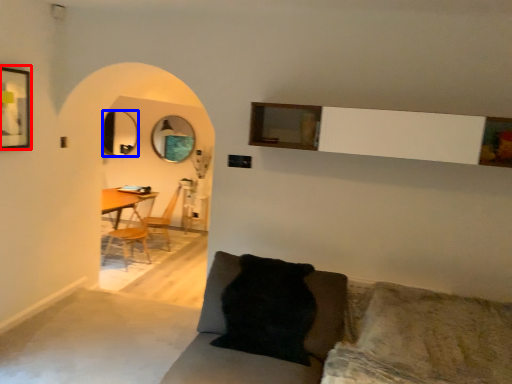
Question: Which object is further to the camera taking this photo, picture frame (highlighted by a red box) or mirror (highlighted by a blue box)?

Choices:
 (A) picture frame
 (B) mirror

Answer: (B)